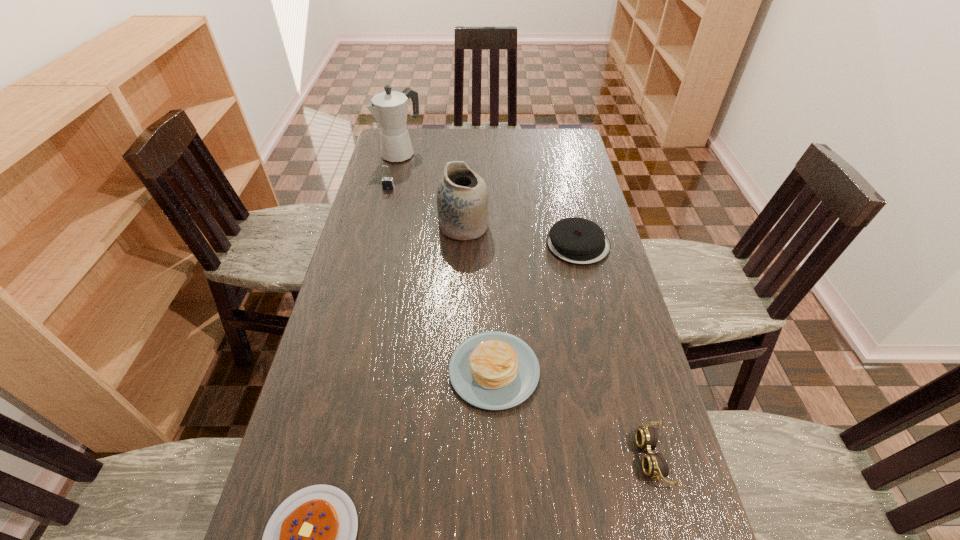
At what (x,y) coordinates should I click in order to perform the action: click on pancake that is at the right edge. Please return your answer as a coordinate pair (x, y). Looking at the image, I should click on (578, 241).

What are the coordinates of `goggles positioned at the right edge` in the screenshot? It's located at (654, 465).

Identify the location of object present at the far left corner. (389, 108).

In the image, there is a desktop. Identify the location of blank space at the far edge. The width and height of the screenshot is (960, 540). (527, 140).

The image size is (960, 540). In the image, there is a desktop. What are the coordinates of `blank space at the left edge` in the screenshot? It's located at (324, 478).

Locate an element on the screen. blank space at the right edge is located at coordinates (557, 188).

Where is `blank space at the far right corner`? Image resolution: width=960 pixels, height=540 pixels. blank space at the far right corner is located at coordinates (574, 158).

Image resolution: width=960 pixels, height=540 pixels. Identify the location of free space between the rightmost pancake and the third nearest object. (536, 307).

At what (x,y) coordinates should I click in order to perform the action: click on empty space that is in between the pottery and the farthest pancake. Please return your answer as a coordinate pair (x, y). Image resolution: width=960 pixels, height=540 pixels. Looking at the image, I should click on (521, 235).

The image size is (960, 540). In order to click on vacant point located between the third tallest object and the coffeepot in this screenshot , I will do `click(395, 171)`.